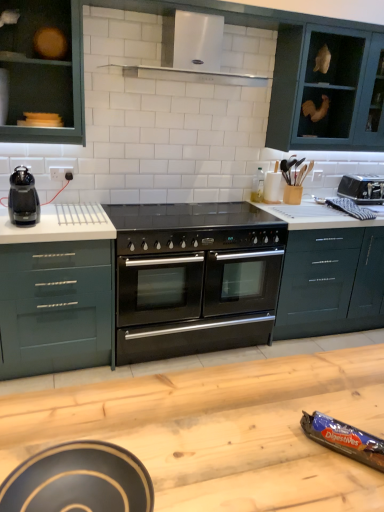
Locate an element on the screen. free space to the back side of black plastic coffee maker at left is located at coordinates (51, 212).